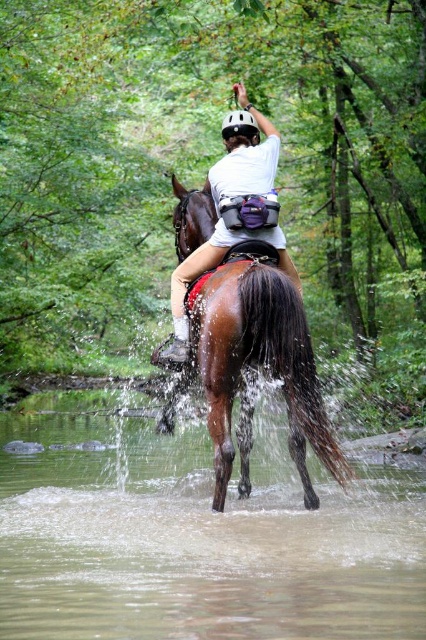
You are a photographer trying to capture the reflection of the brown glossy horse at center in the brown glossy water at lower center. Based on the scene description, can you confirm if the horse is positioned in a way that its reflection would be visible in the water?

The brown glossy water at lower center is located below the brown glossy horse at center, so the horse is above the water. Since reflections require the object to be above the reflective surface, the horse should have a visible reflection in the water.

You are a photographer trying to capture the rider and horse in the stream. You notice the brown glossy water at lower center and the white matte helmet at upper center. Which object in the scene takes up more space in the photo?

The brown glossy water at lower center takes up more space in the photo because it has a larger size compared to the white matte helmet at upper center.